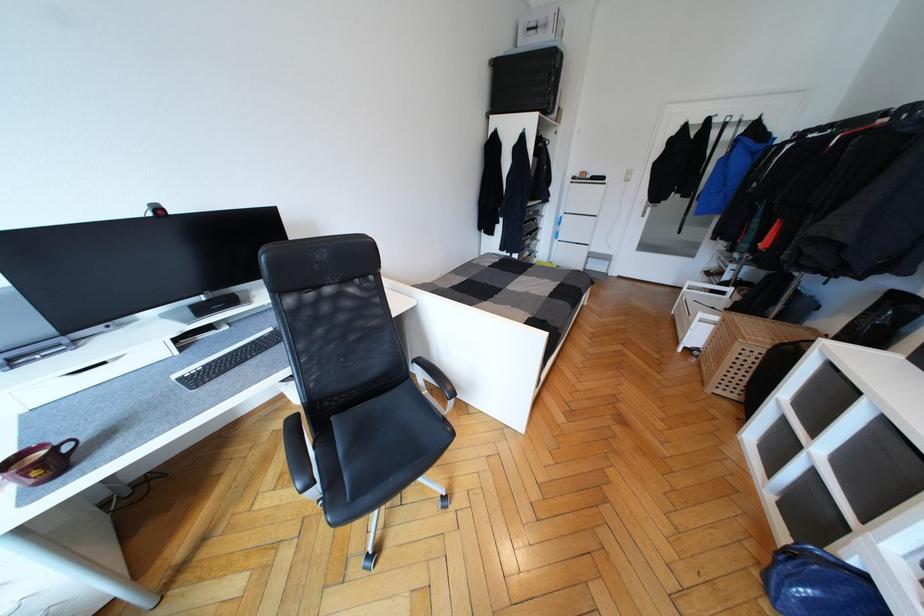
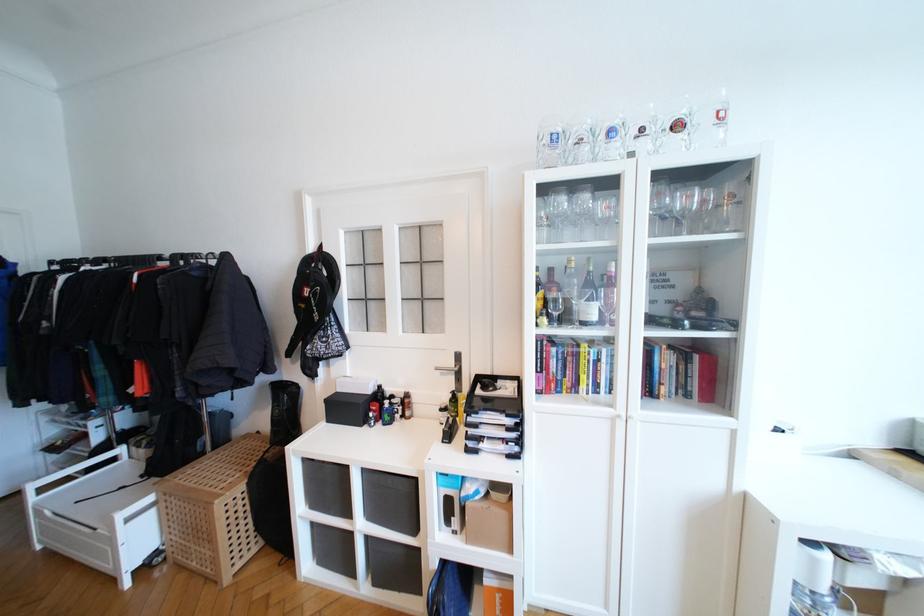
Question: I am providing you with two images of the same scene from different viewpoints. After the viewpoint changes to image2, which objects are now occluded?

Choices:
 (A) clear liquor bottle
 (B) brown cardboard box
 (C) grey storage bin
 (D) none of these

Answer: (D)